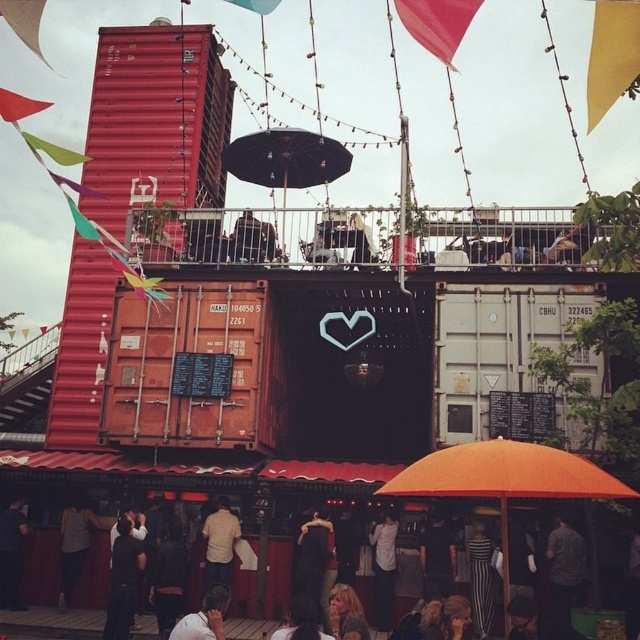
You are a customer at the food stall area and want to place an order. The brown wooden shipping container at center is where the counter is located. Since the blonde hair at center is also present, can you tell me which one is bigger?

The brown wooden shipping container at center is larger in size than blonde hair at center, so the brown wooden shipping container at center is bigger.

You are a photographer taking a picture of the dark gray fabric jacket at lower left and the blonde hair at center. Which object should you focus on first to ensure both are in frame without moving the camera?

The dark gray fabric jacket at lower left is much taller than the blonde hair at center, so you should focus on the taller object first to ensure both are in frame without moving the camera.